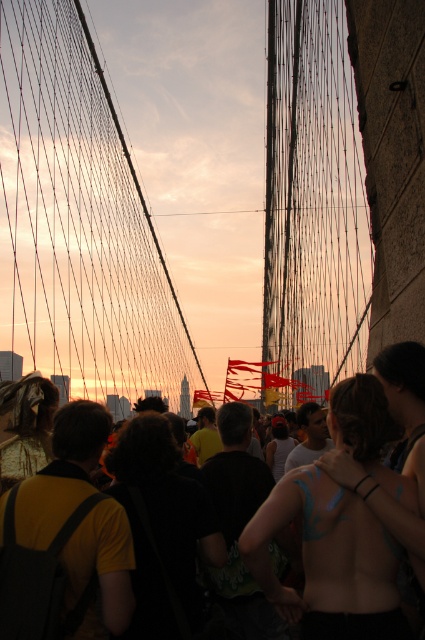
What do you see at coordinates (328, 561) in the screenshot? I see `body paint at center` at bounding box center [328, 561].

Is body paint at center bigger than yellow matte shirt at lower left?

Indeed, body paint at center has a larger size compared to yellow matte shirt at lower left.

Which is in front, point (257, 522) or point (85, 492)?

Point (257, 522) is in front.

Image resolution: width=425 pixels, height=640 pixels. Find the location of `body paint at center`. body paint at center is located at coordinates (328, 561).

Can you confirm if black wire suspension bridge at center is shorter than body paint at center?

Incorrect, black wire suspension bridge at center's height does not fall short of body paint at center's.

Does black wire suspension bridge at center have a smaller size compared to body paint at center?

Incorrect, black wire suspension bridge at center is not smaller in size than body paint at center.

At what (x,y) coordinates should I click in order to perform the action: click on black wire suspension bridge at center. Please return your answer as a coordinate pair (x, y). The height and width of the screenshot is (640, 425). Looking at the image, I should click on (183, 196).

You are a GUI agent. You are given a task and a screenshot of the screen. Output one action in this format:
    pyautogui.click(x=<x>, y=<y>)
    Task: Click on the black wire suspension bridge at center
    This screenshot has height=640, width=425.
    Given the screenshot: What is the action you would take?
    pyautogui.click(x=183, y=196)

Looking at this image, can you confirm if black wire suspension bridge at center is taller than dark yellow shirt at center?

Yes, black wire suspension bridge at center is taller than dark yellow shirt at center.

Describe the element at coordinates (183, 196) in the screenshot. The image size is (425, 640). I see `black wire suspension bridge at center` at that location.

Locate an element on the screen. This screenshot has height=640, width=425. black wire suspension bridge at center is located at coordinates (183, 196).